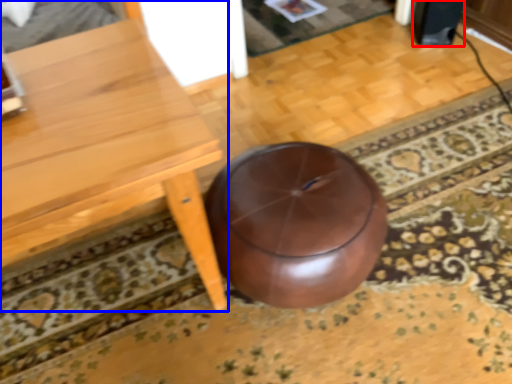
Question: Which point is closer to the camera, speaker (highlighted by a red box) or table (highlighted by a blue box)?

Choices:
 (A) speaker
 (B) table

Answer: (B)